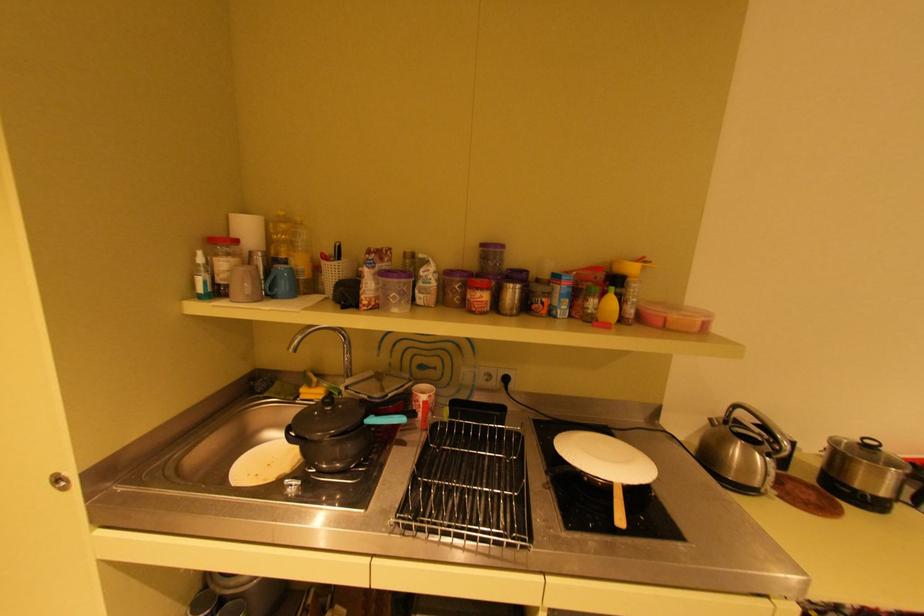
Find where to lift the wooden pan handle. Please return your answer as a coordinate pair (x, y).

(618, 506)